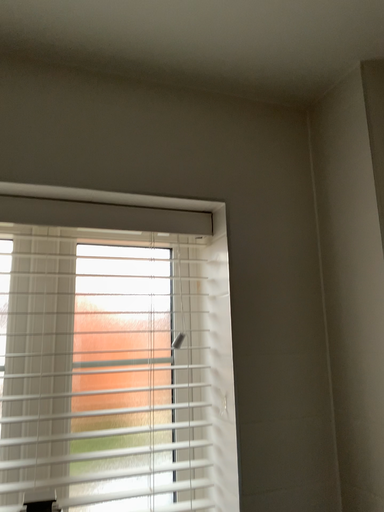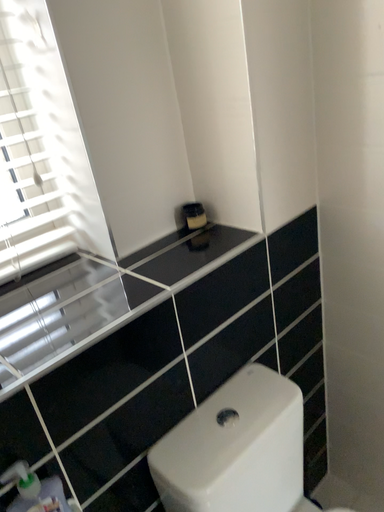
Question: How did the camera likely rotate when shooting the video?

Choices:
 (A) rotated downward
 (B) rotated upward

Answer: (A)